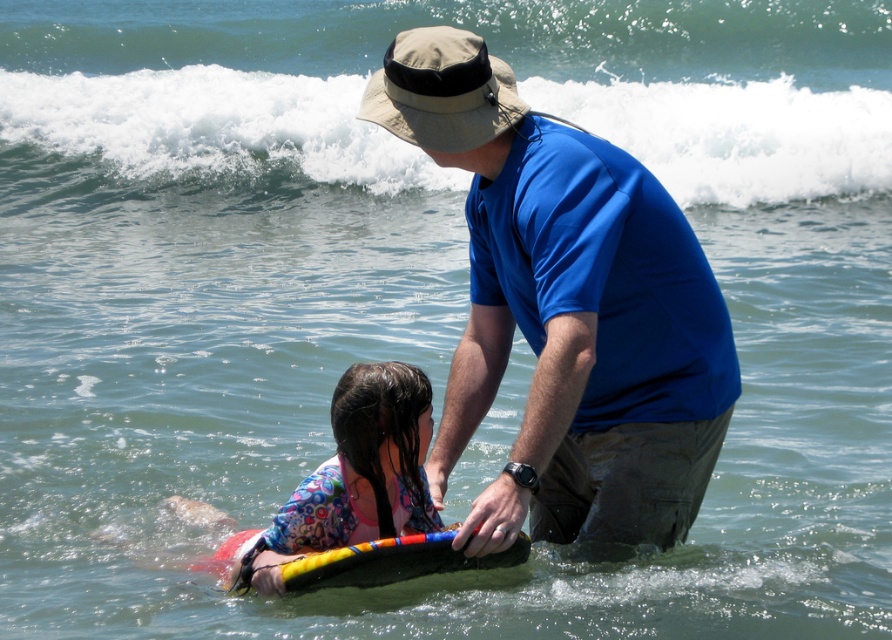
Measure the distance between blue fabric shirt at center and camera.

A distance of 6.77 meters exists between blue fabric shirt at center and camera.

Can you confirm if blue fabric shirt at center is taller than floral fabric swimsuit at lower left?

Yes.

Find the location of `blue fabric shirt at center`. blue fabric shirt at center is located at coordinates (566, 308).

Can you confirm if blue fabric shirt at center is thinner than white foamy wave at upper center?

Correct, blue fabric shirt at center's width is less than white foamy wave at upper center's.

The image size is (892, 640). Describe the element at coordinates (566, 308) in the screenshot. I see `blue fabric shirt at center` at that location.

You are a GUI agent. You are given a task and a screenshot of the screen. Output one action in this format:
    pyautogui.click(x=<x>, y=<y>)
    Task: Click on the blue fabric shirt at center
    The height and width of the screenshot is (640, 892).
    Given the screenshot: What is the action you would take?
    pyautogui.click(x=566, y=308)

Measure the distance between white foamy wave at upper center and camera.

white foamy wave at upper center and camera are 59.21 feet apart.

Who is shorter, white foamy wave at upper center or floral fabric swimsuit at lower left?

Standing shorter between the two is floral fabric swimsuit at lower left.

Image resolution: width=892 pixels, height=640 pixels. Describe the element at coordinates (215, 125) in the screenshot. I see `white foamy wave at upper center` at that location.

Locate an element on the screen. The width and height of the screenshot is (892, 640). white foamy wave at upper center is located at coordinates (215, 125).